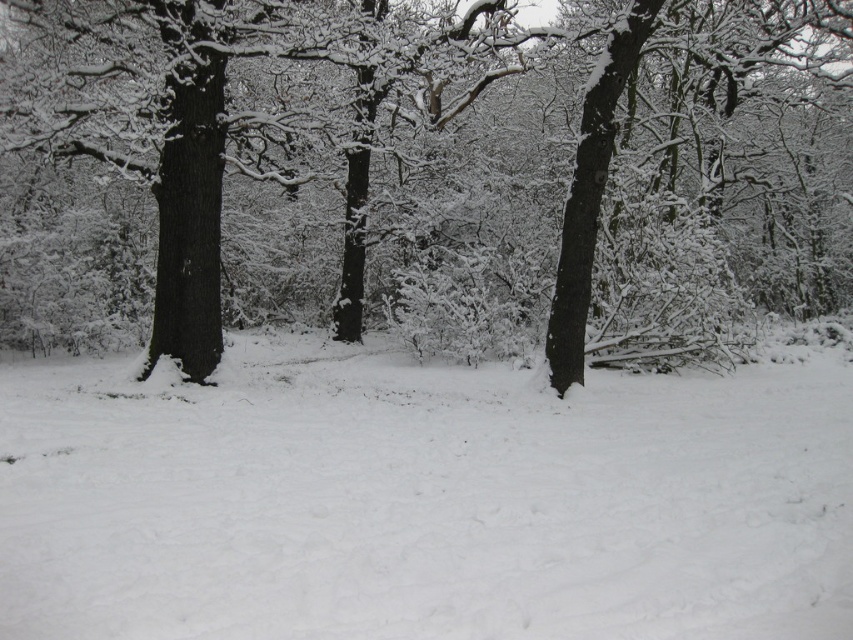
Question: Which point is farther to the camera?

Choices:
 (A) smooth bark tree at center
 (B) white fluffy snow at center

Answer: (A)

Question: Which point is closer to the camera taking this photo?

Choices:
 (A) (228, 40)
 (B) (532, 433)

Answer: (B)

Question: Which point is closer to the camera?

Choices:
 (A) smooth bark tree at center
 (B) white fluffy snow at center

Answer: (B)

Question: Is smooth bark tree at center bigger than white fluffy snow at center?

Choices:
 (A) yes
 (B) no

Answer: (A)

Question: In this image, where is smooth bark tree at center located relative to white fluffy snow at center?

Choices:
 (A) right
 (B) left

Answer: (A)

Question: Considering the relative positions of smooth bark tree at center and white fluffy snow at center in the image provided, where is smooth bark tree at center located with respect to white fluffy snow at center?

Choices:
 (A) right
 (B) left

Answer: (A)